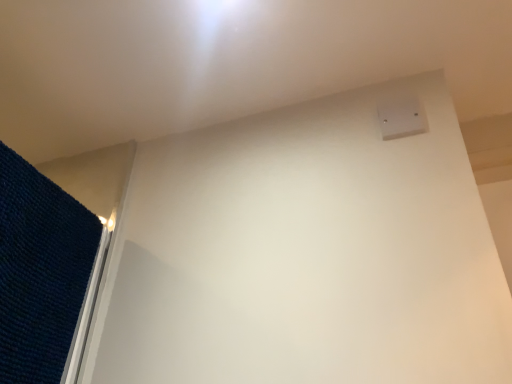
Image resolution: width=512 pixels, height=384 pixels. Describe the element at coordinates (41, 272) in the screenshot. I see `dark blue textured mat at left` at that location.

Locate an element on the screen. Image resolution: width=512 pixels, height=384 pixels. dark blue textured mat at left is located at coordinates (41, 272).

Locate an element on the screen. The image size is (512, 384). white plastic electric outlet at upper right is located at coordinates (401, 117).

What is the approximate height of white plastic electric outlet at upper right?

It is 9.59 centimeters.

The width and height of the screenshot is (512, 384). What do you see at coordinates (401, 117) in the screenshot?
I see `white plastic electric outlet at upper right` at bounding box center [401, 117].

The width and height of the screenshot is (512, 384). I want to click on dark blue textured mat at left, so click(41, 272).

Which object is positioned more to the right, dark blue textured mat at left or white plastic electric outlet at upper right?

Positioned to the right is white plastic electric outlet at upper right.

Is dark blue textured mat at left further to the viewer compared to white plastic electric outlet at upper right?

No, the depth of dark blue textured mat at left is less than that of white plastic electric outlet at upper right.

Is point (32, 281) behind point (411, 101)?

No.

Looking at this image, from the image's perspective, is dark blue textured mat at left located above or below white plastic electric outlet at upper right?

Clearly, from the image's perspective, dark blue textured mat at left is below white plastic electric outlet at upper right.

From a real-world perspective, is dark blue textured mat at left positioned under white plastic electric outlet at upper right based on gravity?

Correct, in the physical world, dark blue textured mat at left is lower than white plastic electric outlet at upper right.

Considering the sizes of objects dark blue textured mat at left and white plastic electric outlet at upper right in the image provided, who is thinner, dark blue textured mat at left or white plastic electric outlet at upper right?

white plastic electric outlet at upper right is thinner.

From the picture: Who is shorter, dark blue textured mat at left or white plastic electric outlet at upper right?

white plastic electric outlet at upper right.

Between dark blue textured mat at left and white plastic electric outlet at upper right, which one has smaller size?

Smaller between the two is white plastic electric outlet at upper right.

Is dark blue textured mat at left completely or partially outside of white plastic electric outlet at upper right?

dark blue textured mat at left lies outside white plastic electric outlet at upper right's area.

Can you see dark blue textured mat at left touching white plastic electric outlet at upper right?

dark blue textured mat at left is not next to white plastic electric outlet at upper right, and they're not touching.

Could you tell me if dark blue textured mat at left is turned towards white plastic electric outlet at upper right?

Yes, dark blue textured mat at left is turned towards white plastic electric outlet at upper right.

How distant is dark blue textured mat at left from white plastic electric outlet at upper right?

A distance of 28.23 inches exists between dark blue textured mat at left and white plastic electric outlet at upper right.

At what (x,y) coordinates should I click in order to perform the action: click on electric outlet above the dark blue textured mat at left (from a real-world perspective). Please return your answer as a coordinate pair (x, y). The image size is (512, 384). Looking at the image, I should click on (401, 117).

Which is more to the right, white plastic electric outlet at upper right or dark blue textured mat at left?

white plastic electric outlet at upper right is more to the right.

Considering the positions of objects white plastic electric outlet at upper right and dark blue textured mat at left in the image provided, who is in front, white plastic electric outlet at upper right or dark blue textured mat at left?

dark blue textured mat at left is more forward.

Is point (389, 107) closer or farther from the camera than point (23, 365)?

Point (389, 107) appears to be farther away from the viewer than point (23, 365).

From the image's perspective, which is above, white plastic electric outlet at upper right or dark blue textured mat at left?

white plastic electric outlet at upper right appears higher in the image.

From a real-world perspective, who is located higher, white plastic electric outlet at upper right or dark blue textured mat at left?

white plastic electric outlet at upper right is physically above.

Looking at their sizes, would you say white plastic electric outlet at upper right is wider or thinner than dark blue textured mat at left?

Considering their sizes, white plastic electric outlet at upper right looks slimmer than dark blue textured mat at left.

Looking at this image, is white plastic electric outlet at upper right taller or shorter than dark blue textured mat at left?

Considering their sizes, white plastic electric outlet at upper right has less height than dark blue textured mat at left.

Considering the sizes of objects white plastic electric outlet at upper right and dark blue textured mat at left in the image provided, who is smaller, white plastic electric outlet at upper right or dark blue textured mat at left?

Smaller between the two is white plastic electric outlet at upper right.

Is white plastic electric outlet at upper right outside of dark blue textured mat at left?

white plastic electric outlet at upper right lies outside dark blue textured mat at left's area.

Is white plastic electric outlet at upper right far from dark blue textured mat at left?

That's not correct — white plastic electric outlet at upper right is a little close to dark blue textured mat at left.

Based on the photo, is white plastic electric outlet at upper right aimed at dark blue textured mat at left?

No, white plastic electric outlet at upper right is not facing towards dark blue textured mat at left.

Where is `mat below the white plastic electric outlet at upper right (from the image's perspective)`? mat below the white plastic electric outlet at upper right (from the image's perspective) is located at coordinates (41, 272).

You are a GUI agent. You are given a task and a screenshot of the screen. Output one action in this format:
    pyautogui.click(x=<x>, y=<y>)
    Task: Click on the mat on the left side of white plastic electric outlet at upper right
    
    Given the screenshot: What is the action you would take?
    pyautogui.click(x=41, y=272)

You are a GUI agent. You are given a task and a screenshot of the screen. Output one action in this format:
    pyautogui.click(x=<x>, y=<y>)
    Task: Click on the electric outlet above the dark blue textured mat at left (from the image's perspective)
    The height and width of the screenshot is (384, 512).
    Given the screenshot: What is the action you would take?
    pyautogui.click(x=401, y=117)